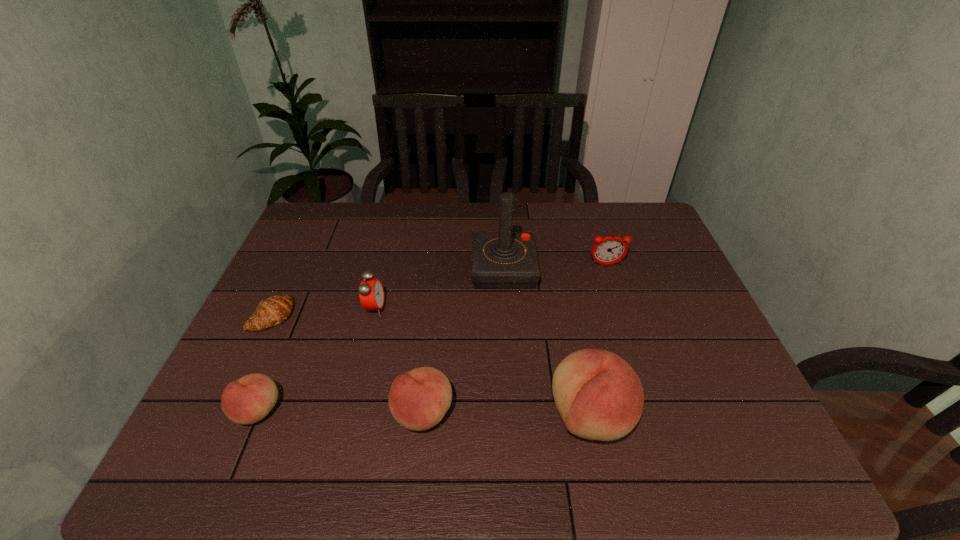
Where is `peach located at the left edge`? Image resolution: width=960 pixels, height=540 pixels. peach located at the left edge is located at coordinates (249, 399).

The width and height of the screenshot is (960, 540). In order to click on crescent roll located at the left edge in this screenshot , I will do `click(276, 309)`.

Locate an element on the screen. object that is at the near left corner is located at coordinates (249, 399).

Locate an element on the screen. free region at the far edge is located at coordinates (571, 218).

Find the location of a particular element. blank space at the near edge of the desktop is located at coordinates (522, 414).

I want to click on free space at the left edge of the desktop, so click(320, 245).

Where is `free space at the right edge of the desktop`? free space at the right edge of the desktop is located at coordinates (644, 310).

Identify the location of vacant space at the far left corner. (348, 204).

In the image, there is a desktop. What are the coordinates of `free space at the near right corner` in the screenshot? It's located at (735, 408).

At what (x,y) coordinates should I click in order to perform the action: click on empty space that is in between the shortest object and the left alarm clock. Please return your answer as a coordinate pair (x, y). Looking at the image, I should click on [x=324, y=312].